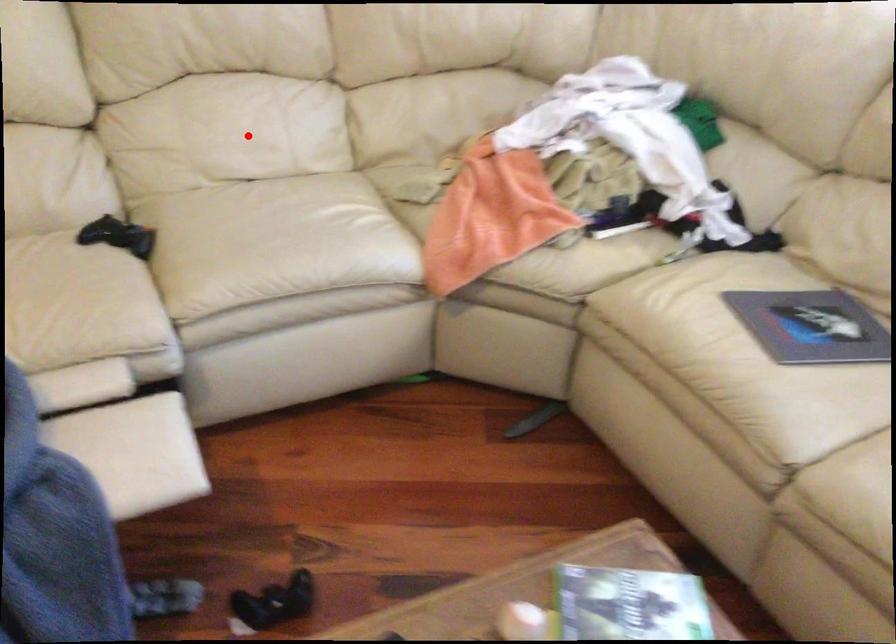
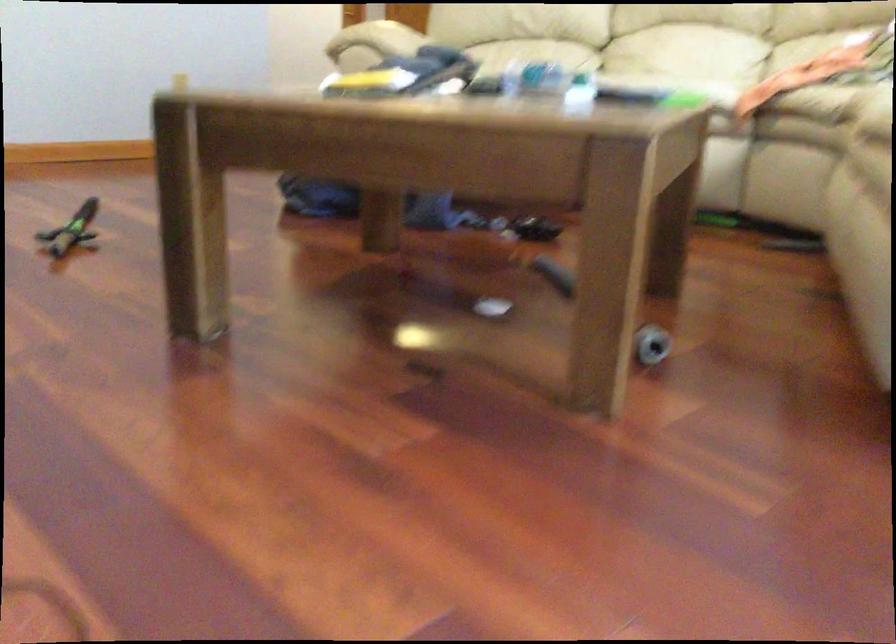
Question: I am providing you with two images of the same scene from different viewpoints. A red point is shown in image1. For the corresponding object point in image2, is it positioned nearer or farther from the camera?

Choices:
 (A) Nearer
 (B) Farther

Answer: (B)